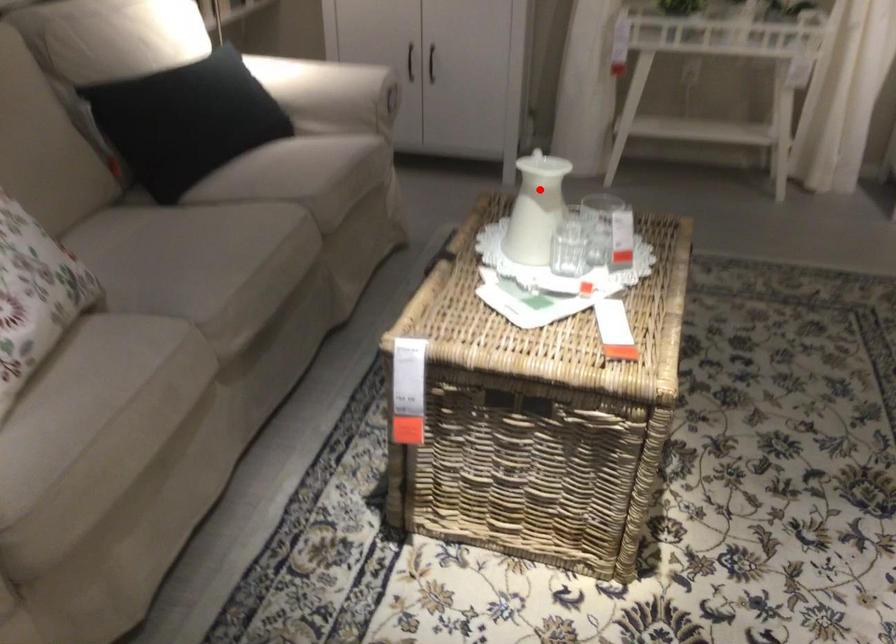
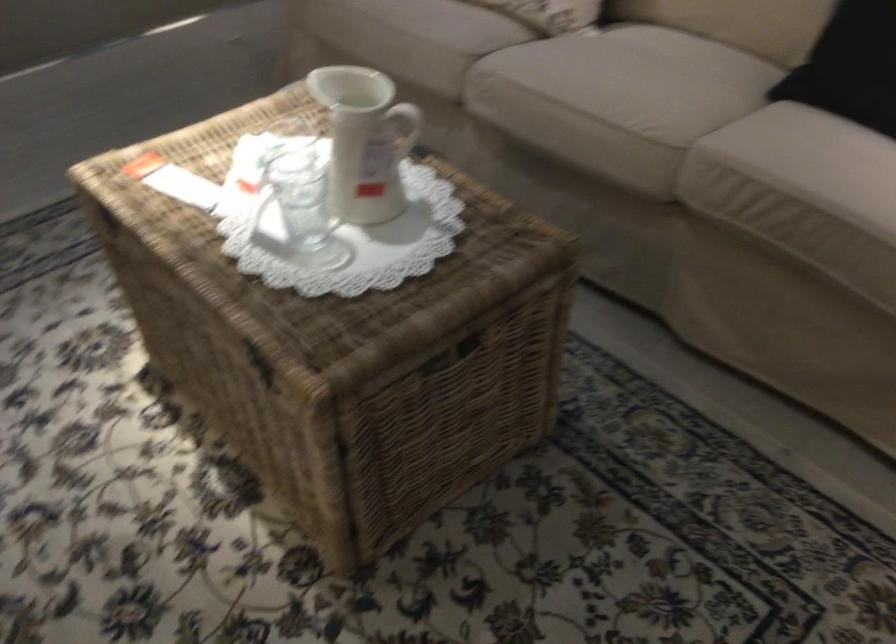
Find the pixel in the second image that matches the highlighted location in the first image.

(365, 140)